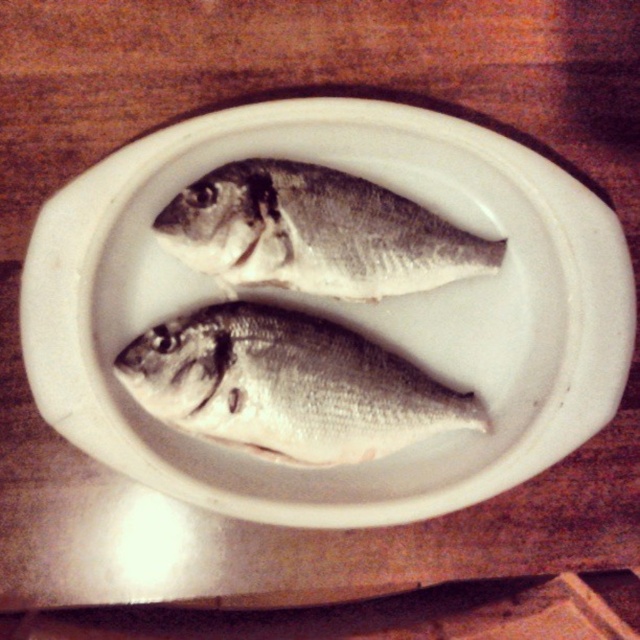
Question: Which of the following is the farthest from the observer?

Choices:
 (A) silver/glossy fish at center
 (B) shiny silver fish at center

Answer: (A)

Question: Does shiny silver fish at center appear over silver/glossy fish at center?

Choices:
 (A) no
 (B) yes

Answer: (A)

Question: Which object is farther from the camera taking this photo?

Choices:
 (A) silver/glossy fish at center
 (B) white ceramic plate at center

Answer: (A)

Question: Can you confirm if white ceramic plate at center is positioned above shiny silver fish at center?

Choices:
 (A) yes
 (B) no

Answer: (A)

Question: Can you confirm if shiny silver fish at center is bigger than silver/glossy fish at center?

Choices:
 (A) no
 (B) yes

Answer: (B)

Question: Which point is closer to the camera taking this photo?

Choices:
 (A) (186, 252)
 (B) (221, 339)

Answer: (A)